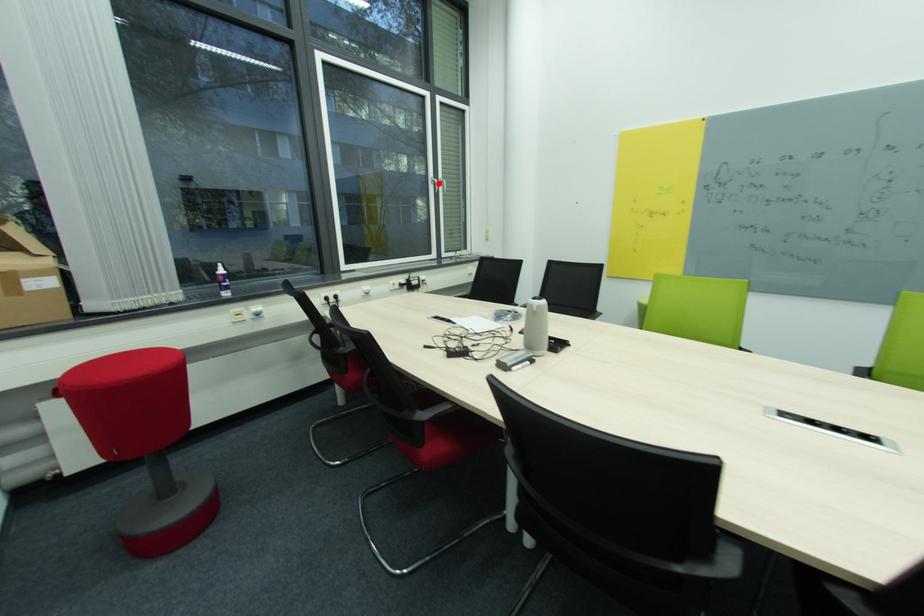
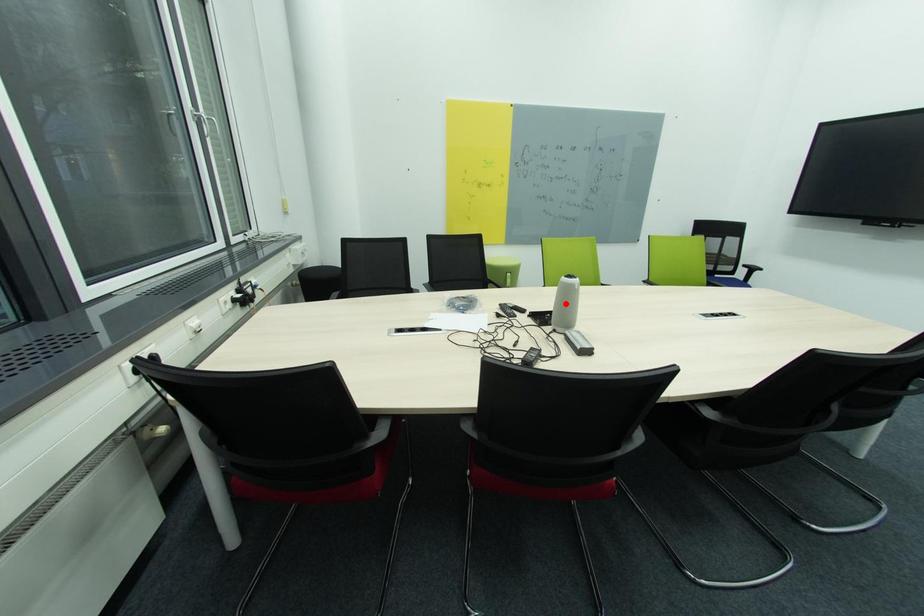
I am providing you with two images of the same scene from different viewpoints. A red point is marked on the first image and another point is marked on the second image. Do the highlighted points in image1 and image2 indicate the same real-world spot?

No